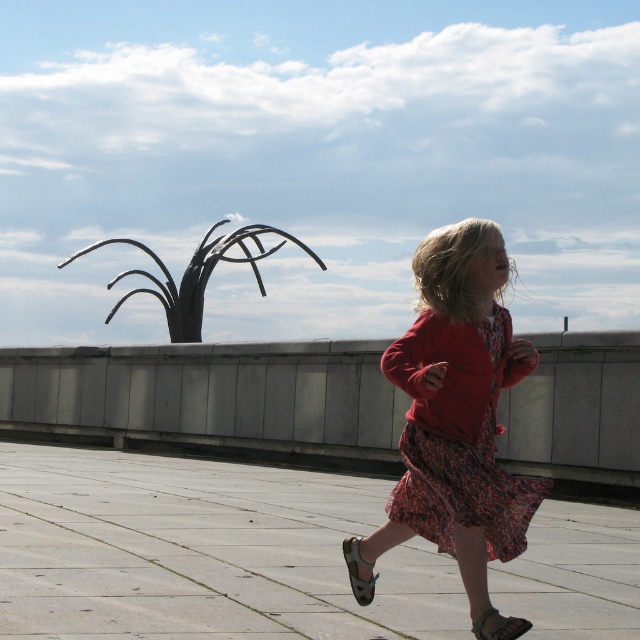
You are a delivery drone that needs to land on the smooth concrete pavement at center. The black metal sculpture at upper center is in your path. Can you safely land without hitting the sculpture?

The smooth concrete pavement at center is smaller than the black metal sculpture at upper center, so the sculpture might block the landing area. You should choose a different spot or adjust your approach to avoid collision.